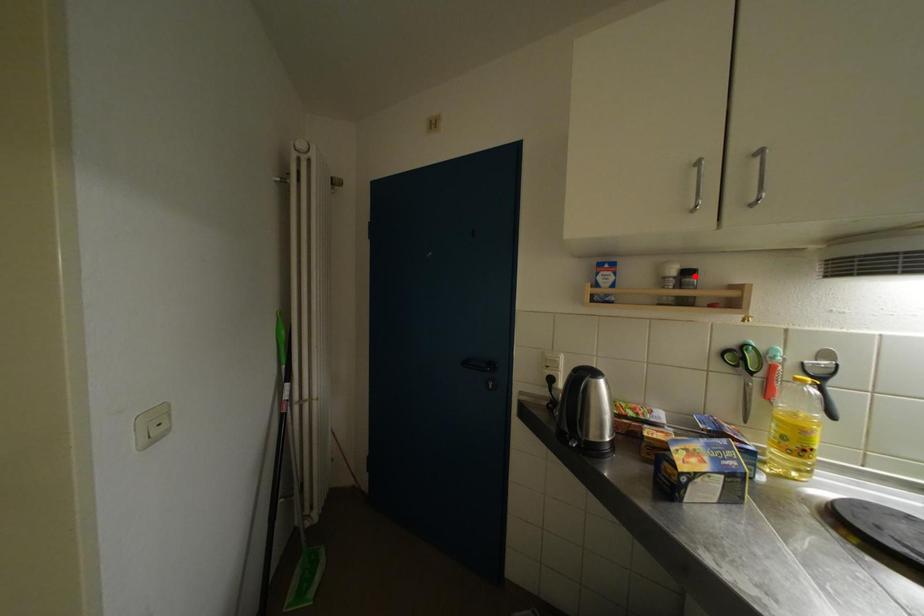
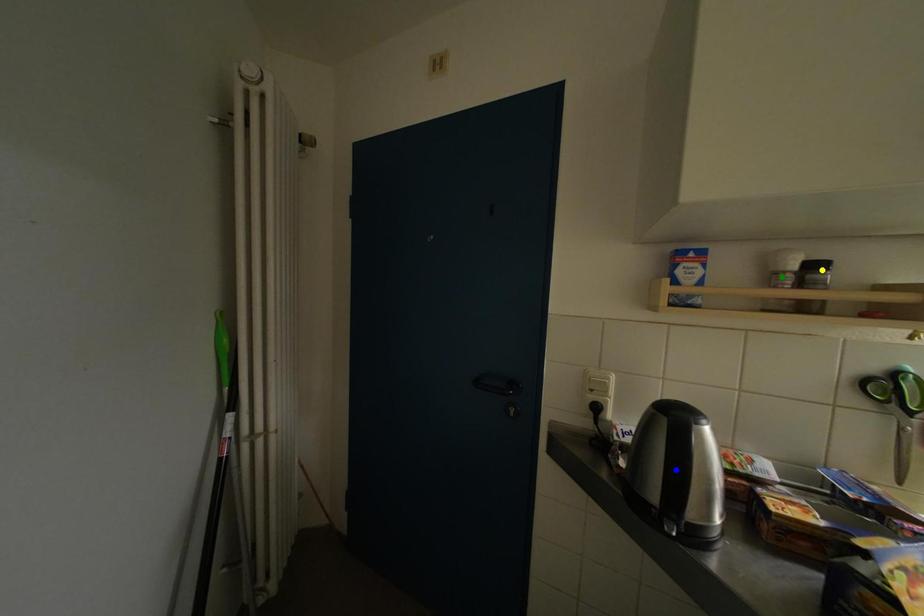
Question: I am providing you with two images of the same scene from different viewpoints. A red point is marked on the first image. You are given multiple points on the second image. Which mark in image 2 goes with the point in image 1?

Choices:
 (A) yellow point
 (B) green point
 (C) blue point

Answer: (A)